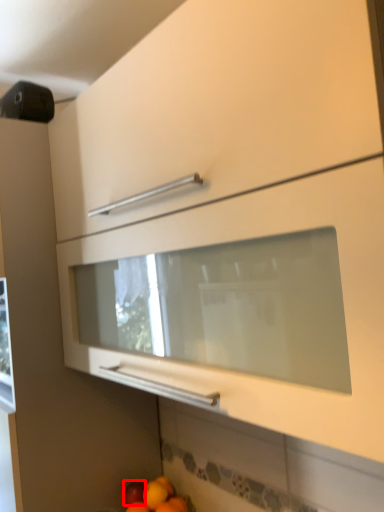
Question: From the image's perspective, what is the correct spatial positioning of apple (annotated by the red box) in reference to orange?

Choices:
 (A) above
 (B) below

Answer: (B)